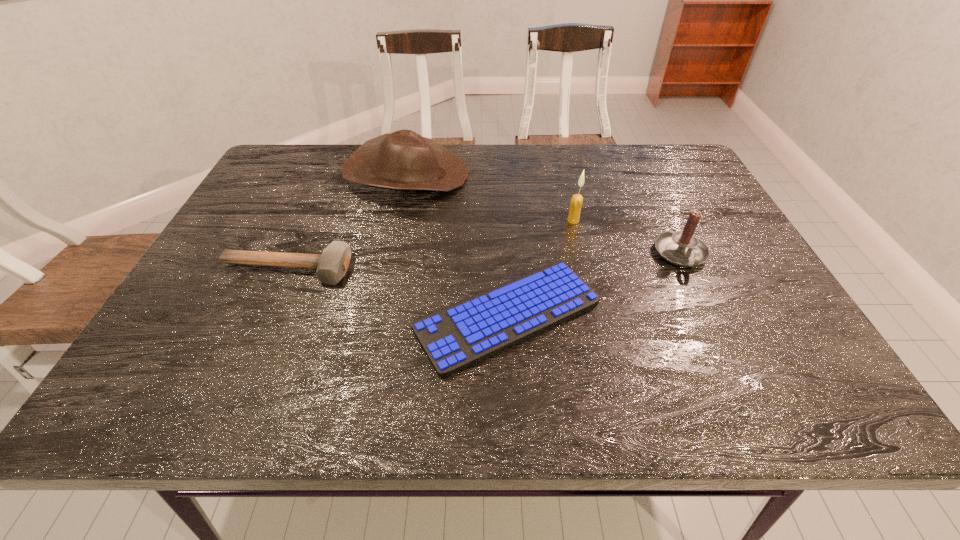
Find the location of `free space located on the back of the mallet`. free space located on the back of the mallet is located at coordinates (312, 213).

Where is `free space located on the right of the shortest object`? free space located on the right of the shortest object is located at coordinates (780, 316).

Find the location of a particular element. object that is at the far edge is located at coordinates (403, 160).

This screenshot has width=960, height=540. Identify the location of object that is at the near edge. (460, 335).

Where is `object present at the left edge`? object present at the left edge is located at coordinates (332, 264).

Find the location of a particular element. This screenshot has height=540, width=960. object that is at the right edge is located at coordinates (682, 248).

Find the location of `vacant region at the far edge of the desktop`. vacant region at the far edge of the desktop is located at coordinates (624, 180).

The height and width of the screenshot is (540, 960). In order to click on free point at the near edge in this screenshot , I will do `click(507, 396)`.

Find the location of a particular element. The image size is (960, 540). free location at the left edge is located at coordinates (248, 321).

At what (x,y) coordinates should I click in order to perform the action: click on vacant space at the right edge of the desktop. Please return your answer as a coordinate pair (x, y). The width and height of the screenshot is (960, 540). Looking at the image, I should click on (774, 298).